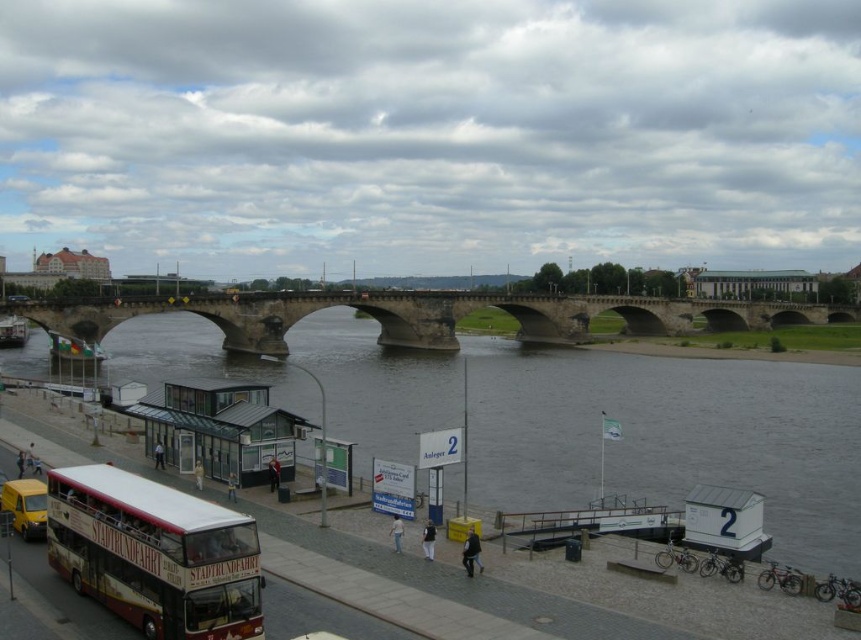
You are a tourist standing at the riverside and want to take a photo of both the concrete bridge at center and the white glass bus station at lower left. Which object should you frame first in your camera to ensure both are fully visible in the photo?

You should frame the concrete bridge at center first because it is larger in size compared to the white glass bus station at lower left, so it requires more space in the photo.